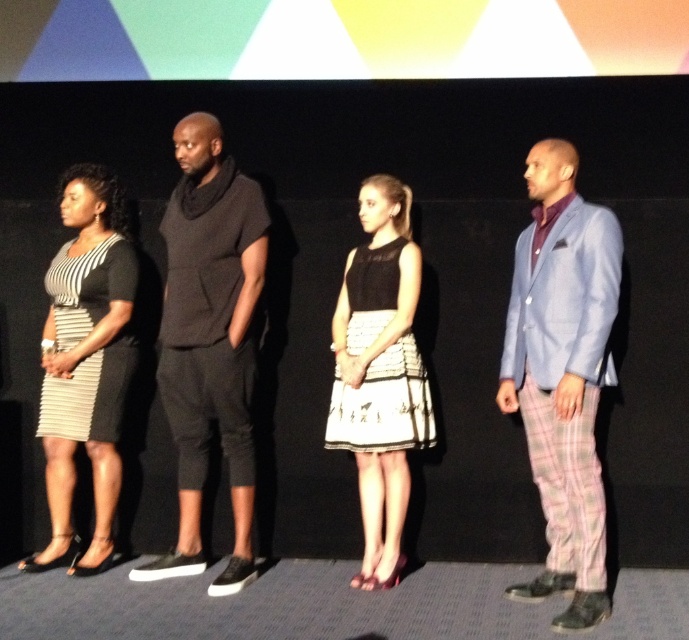
Is black matte sweater at center thinner than black satin dress at center?

Incorrect, black matte sweater at center's width is not less than black satin dress at center's.

Which of these two, black matte sweater at center or black satin dress at center, stands taller?

Standing taller between the two is black matte sweater at center.

Who is more forward, (225, 230) or (422, 432)?

Point (225, 230) is more forward.

At what (x,y) coordinates should I click in order to perform the action: click on black matte sweater at center. Please return your answer as a coordinate pair (x, y). Looking at the image, I should click on (209, 340).

Measure the distance between black matte sweater at center and camera.

black matte sweater at center is 3.53 meters away from camera.

Between point (183, 472) and point (105, 500), which one is positioned behind?

The point (105, 500) is more distant.

You are a GUI agent. You are given a task and a screenshot of the screen. Output one action in this format:
    pyautogui.click(x=<x>, y=<y>)
    Task: Click on the black matte sweater at center
    Image resolution: width=689 pixels, height=640 pixels.
    Given the screenshot: What is the action you would take?
    pyautogui.click(x=209, y=340)

Between striped fabric dress at left and black satin dress at center, which one appears on the right side from the viewer's perspective?

→ black satin dress at center is more to the right.

Locate an element on the screen. This screenshot has width=689, height=640. striped fabric dress at left is located at coordinates (85, 362).

You are a GUI agent. You are given a task and a screenshot of the screen. Output one action in this format:
    pyautogui.click(x=<x>, y=<y>)
    Task: Click on the striped fabric dress at left
    The image size is (689, 640).
    Given the screenshot: What is the action you would take?
    pyautogui.click(x=85, y=362)